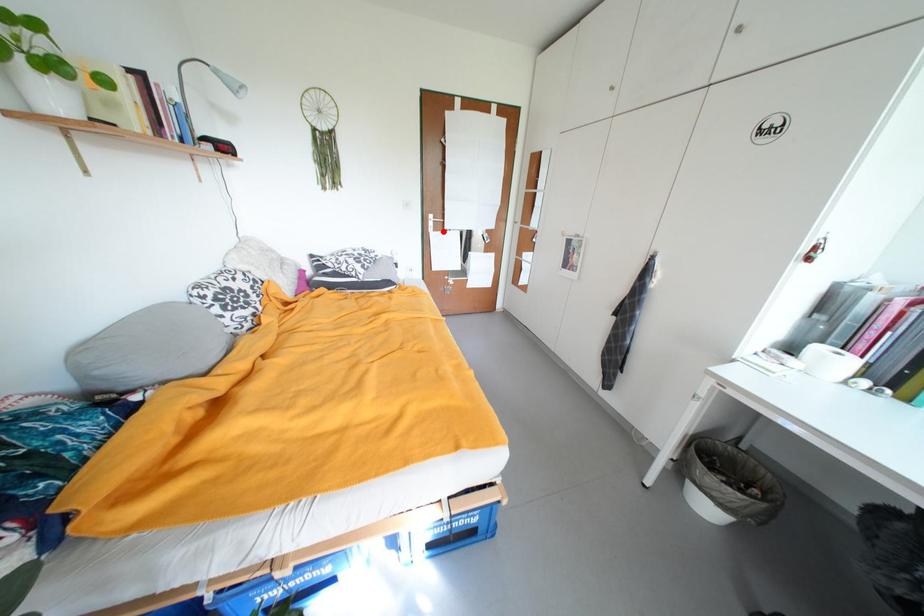
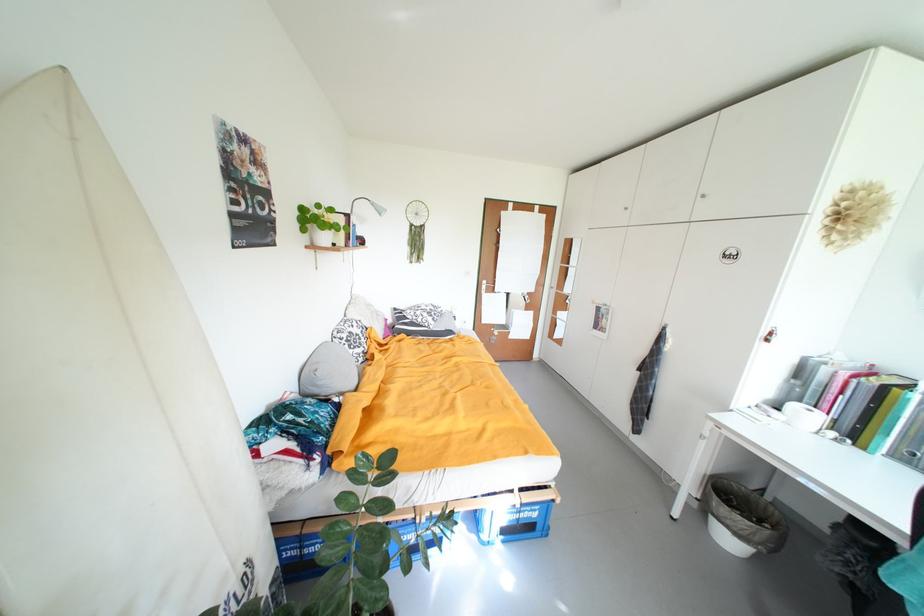
Question: I am providing you with two images of the same scene from different viewpoints. Image1 has a red point marked. In image2, the corresponding 3D location appears at what relative position? Reply with the corresponding letter.

Choices:
 (A) Closer
 (B) Farther

Answer: (B)